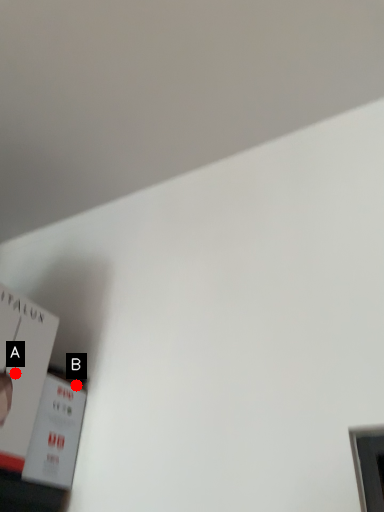
Question: Two points are circled on the image, labeled by A and B beside each circle. Which point appears closest to the camera in this image?

Choices:
 (A) A is closer
 (B) B is closer

Answer: (A)